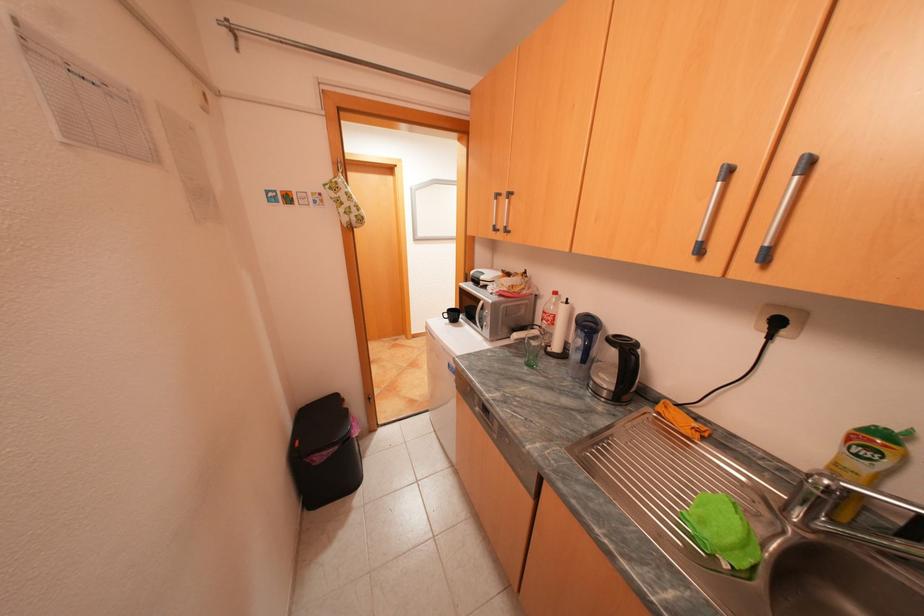
Where is `green sponge`? This screenshot has width=924, height=616. green sponge is located at coordinates (722, 530).